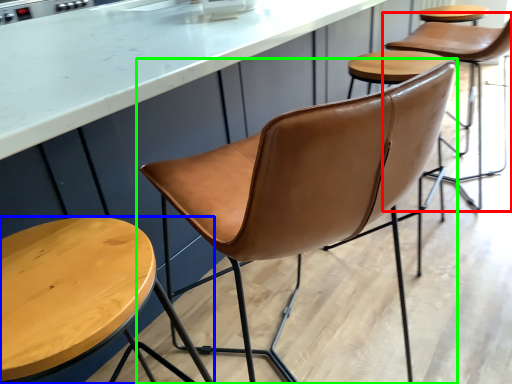
Question: Estimate the real-world distances between objects in this image. Which object is farther from chair (highlighted by a red box), stool (highlighted by a blue box) or chair (highlighted by a green box)?

Choices:
 (A) stool
 (B) chair

Answer: (A)